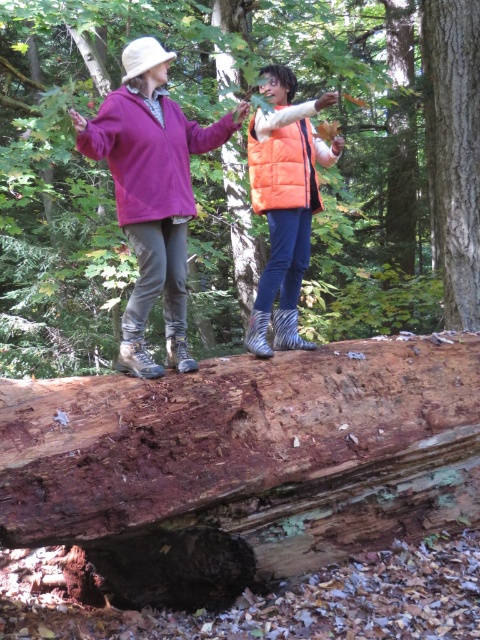
Is smooth bark tree trunk at center further to camera compared to orange quilted vest at center?

Yes, it is.

Does smooth bark tree trunk at center have a lesser width compared to orange quilted vest at center?

Correct, smooth bark tree trunk at center's width is less than orange quilted vest at center's.

This screenshot has width=480, height=640. What do you see at coordinates (454, 148) in the screenshot?
I see `smooth bark tree trunk at center` at bounding box center [454, 148].

I want to click on smooth bark tree trunk at center, so click(x=454, y=148).

From the picture: Does matte purple fleece at upper left appear on the left side of rough bark tree trunk at center?

Yes, matte purple fleece at upper left is to the left of rough bark tree trunk at center.

Is matte purple fleece at upper left closer to camera compared to rough bark tree trunk at center?

Yes, matte purple fleece at upper left is closer to the viewer.

What are the coordinates of `matte purple fleece at upper left` in the screenshot? It's located at (152, 193).

Which is in front, point (263, 428) or point (159, 204)?

Point (159, 204)

Can you confirm if brown rough wood log at center is positioned above matte purple fleece at upper left?

Incorrect, brown rough wood log at center is not positioned above matte purple fleece at upper left.

What do you see at coordinates (243, 465) in the screenshot?
I see `brown rough wood log at center` at bounding box center [243, 465].

Image resolution: width=480 pixels, height=640 pixels. What are the coordinates of `brown rough wood log at center` in the screenshot? It's located at (243, 465).